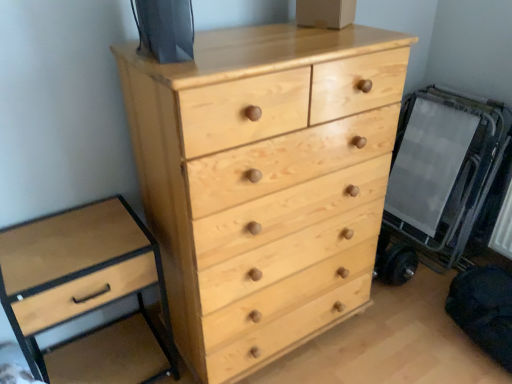
Question: From a real-world perspective, is light wood/texture drawer at left, the 2th chest of drawers from the right, positioned over natural wood chest of drawers at center, which appears as the first chest of drawers when viewed from the right, based on gravity?

Choices:
 (A) yes
 (B) no

Answer: (B)

Question: Is there a large distance between light wood/texture drawer at left, which is the 1th chest of drawers from left to right, and natural wood chest of drawers at center, the second chest of drawers from the left?

Choices:
 (A) no
 (B) yes

Answer: (A)

Question: Is light wood/texture drawer at left, the 2th chest of drawers from the right, closer to the viewer compared to natural wood chest of drawers at center, the second chest of drawers from the left?

Choices:
 (A) no
 (B) yes

Answer: (A)

Question: Is light wood/texture drawer at left, which is the 1th chest of drawers from left to right, turned away from natural wood chest of drawers at center, which appears as the first chest of drawers when viewed from the right?

Choices:
 (A) no
 (B) yes

Answer: (A)

Question: From a real-world perspective, is light wood/texture drawer at left, the 2th chest of drawers from the right, below natural wood chest of drawers at center, the second chest of drawers from the left?

Choices:
 (A) yes
 (B) no

Answer: (A)

Question: Considering the relative sizes of light wood/texture drawer at left, which is the 1th chest of drawers from left to right, and natural wood chest of drawers at center, the second chest of drawers from the left, in the image provided, is light wood/texture drawer at left, which is the 1th chest of drawers from left to right, shorter than natural wood chest of drawers at center, the second chest of drawers from the left,?

Choices:
 (A) yes
 (B) no

Answer: (A)

Question: Is natural wood chest of drawers at center, the second chest of drawers from the left, taller than light wood/texture drawer at left, the 2th chest of drawers from the right?

Choices:
 (A) yes
 (B) no

Answer: (A)

Question: Does natural wood chest of drawers at center, which appears as the first chest of drawers when viewed from the right, appear on the right side of light wood/texture drawer at left, the 2th chest of drawers from the right?

Choices:
 (A) yes
 (B) no

Answer: (A)

Question: Could you tell me if natural wood chest of drawers at center, which appears as the first chest of drawers when viewed from the right, is facing light wood/texture drawer at left, the 2th chest of drawers from the right?

Choices:
 (A) yes
 (B) no

Answer: (B)

Question: Is natural wood chest of drawers at center, the second chest of drawers from the left, far away from light wood/texture drawer at left, which is the 1th chest of drawers from left to right?

Choices:
 (A) no
 (B) yes

Answer: (A)

Question: Does natural wood chest of drawers at center, the second chest of drawers from the left, have a smaller size compared to light wood/texture drawer at left, which is the 1th chest of drawers from left to right?

Choices:
 (A) no
 (B) yes

Answer: (A)

Question: Could light wood/texture drawer at left, the 2th chest of drawers from the right, be considered to be inside natural wood chest of drawers at center, which appears as the first chest of drawers when viewed from the right?

Choices:
 (A) no
 (B) yes

Answer: (A)

Question: Looking at the image, does light wood/texture drawer at left, which is the 1th chest of drawers from left to right, seem bigger or smaller compared to natural wood chest of drawers at center, which appears as the first chest of drawers when viewed from the right?

Choices:
 (A) small
 (B) big

Answer: (A)